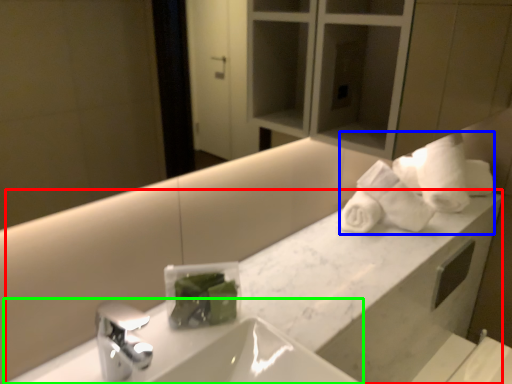
Question: Estimate the real-world distances between objects in this image. Which object is closer to counter (highlighted by a red box), bath towel (highlighted by a blue box) or sink (highlighted by a green box)?

Choices:
 (A) bath towel
 (B) sink

Answer: (A)